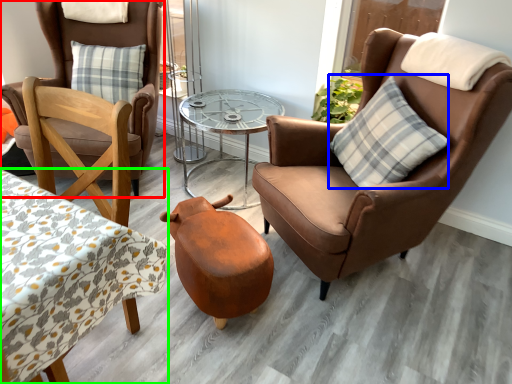
Question: Which is farther away from chair (highlighted by a red box)? pillow (highlighted by a blue box) or coffee table (highlighted by a green box)?

Choices:
 (A) pillow
 (B) coffee table

Answer: (A)